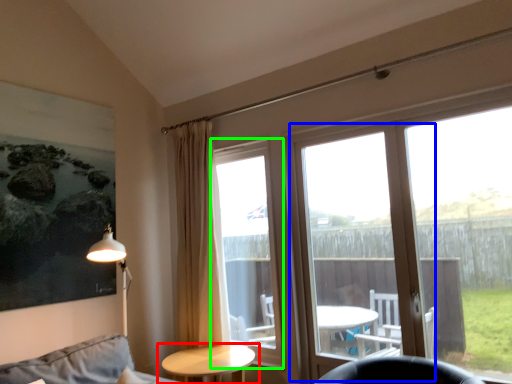
Question: Based on their relative distances, which object is farther from table (highlighted by a red box)? Choose from screen door (highlighted by a blue box) and bay window (highlighted by a green box).

Choices:
 (A) screen door
 (B) bay window

Answer: (A)